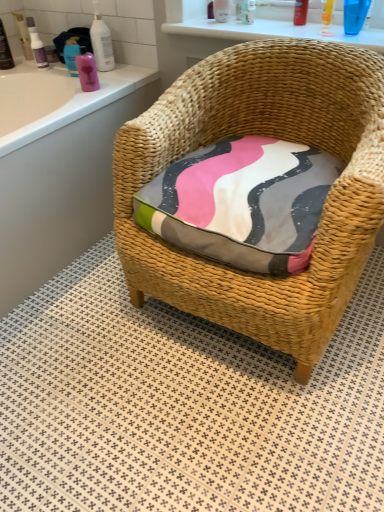
This screenshot has width=384, height=512. Identify the location of free space in front of pink glossy bottle at upper left, which is counted as the 6th toiletry, starting from the right. (80, 100).